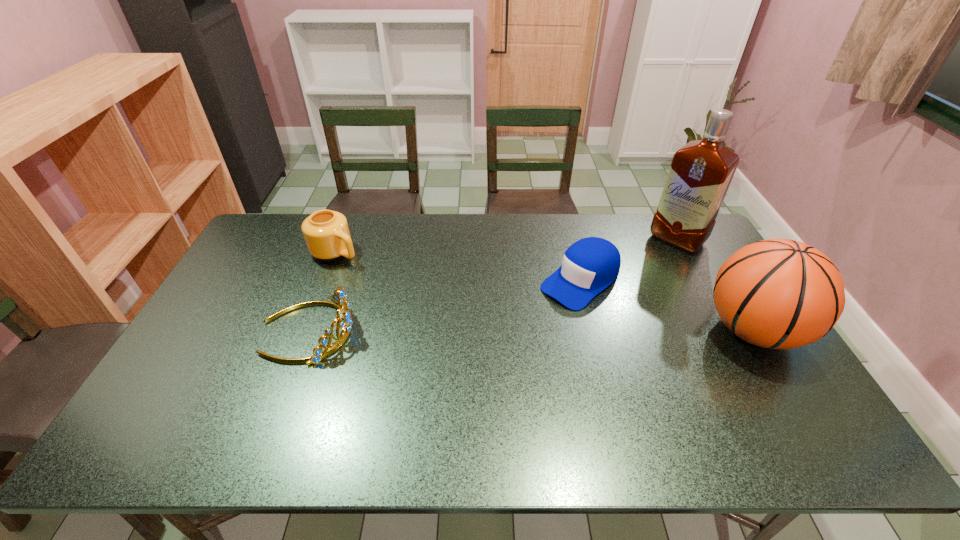
Locate an element on the screen. The width and height of the screenshot is (960, 540). free space that satisfies the following two spatial constraints: 1. on the front side of the tiara; 2. on the front-facing side of the mug is located at coordinates (305, 330).

Identify the location of vacant region that satisfies the following two spatial constraints: 1. on the front side of the mug; 2. on the front-facing side of the tiara. (305, 330).